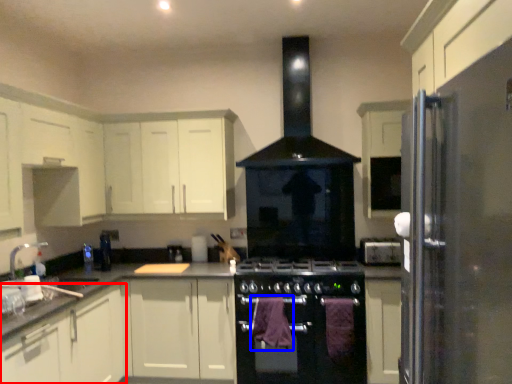
Question: Among these objects, which one is farthest to the camera, cabinetry (highlighted by a red box) or blanket (highlighted by a blue box)?

Choices:
 (A) cabinetry
 (B) blanket

Answer: (B)